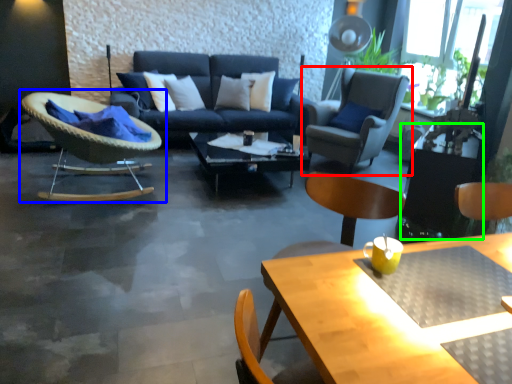
Question: Which is nearer to the chair (highlighted by a red box)? chair (highlighted by a blue box) or side table (highlighted by a green box).

Choices:
 (A) chair
 (B) side table

Answer: (B)